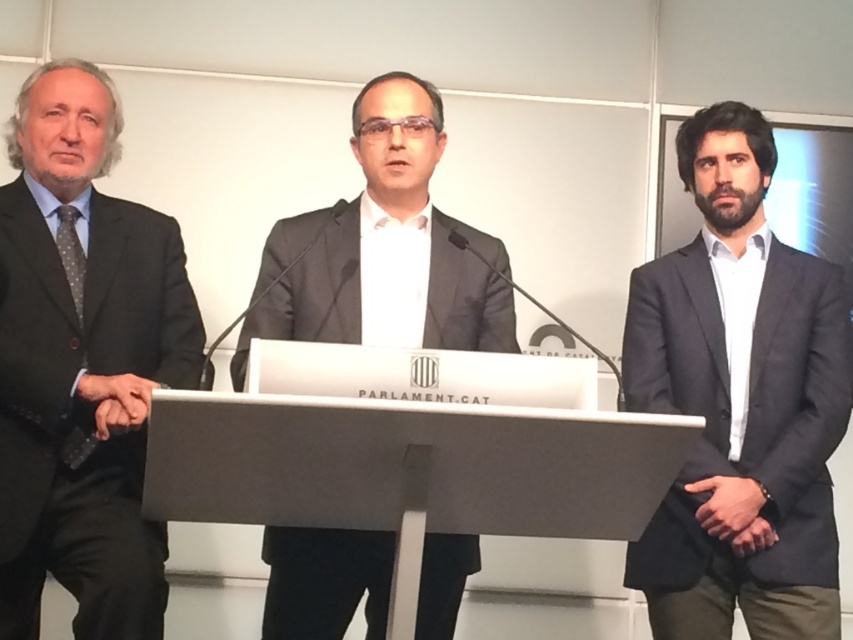
You are attending a press conference and need to take notes about the positions of the speakers. The primary speaker is at the center. Which speaker is wearing the dark gray suit at right and where is their position relative to the central speaker?

The dark gray suit at right is worn by the third man standing to the right of the central speaker. According to the coordinates provided in the Objects Description, the dark gray suit at right is located at point 0.630 on the x and 0.868 on the y axis, which places him to the right and slightly above the central speaker in the image.

You are standing in front of the podium and want to place a name tag on either the point at position (811, 579) or the point at position (352, 148). Which point is closer to you?

The point at position (811, 579) is closer to the camera than the point at position (352, 148), so you should place the name tag there.

You are an event planner setting up a photo shoot for the press conference. The photographer wants to ensure there is enough space between the black textured suit at left and the white matte podium at center for a camera dolly to move smoothly. The dolly requires at least 60 centimeters of clearance. Can the dolly fit between them?

The black textured suit at left and the white matte podium at center are 72.07 centimeters apart, which is more than the required 60 centimeters. Therefore, the camera dolly can fit between them with sufficient clearance.